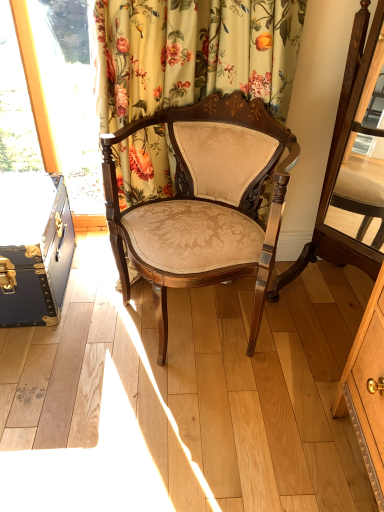
You are a GUI agent. You are given a task and a screenshot of the screen. Output one action in this format:
    pyautogui.click(x=<x>, y=<y>)
    Task: Click on the free region under matte brown wood swivel chair at center (from a real-world perspective)
    The height and width of the screenshot is (512, 384).
    Given the screenshot: What is the action you would take?
    pyautogui.click(x=327, y=309)